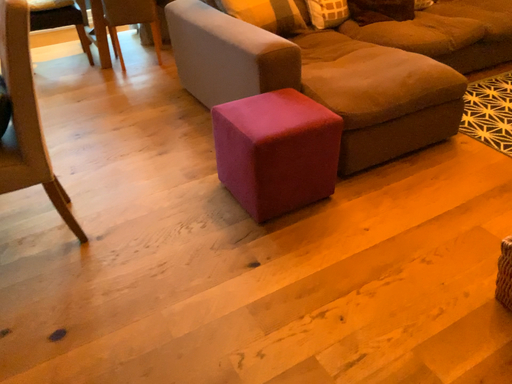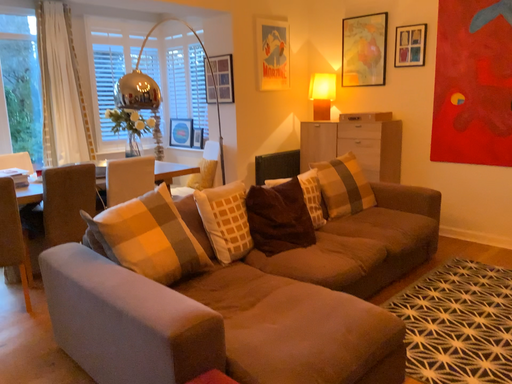
Question: How did the camera likely rotate when shooting the video?

Choices:
 (A) rotated left
 (B) rotated right

Answer: (B)